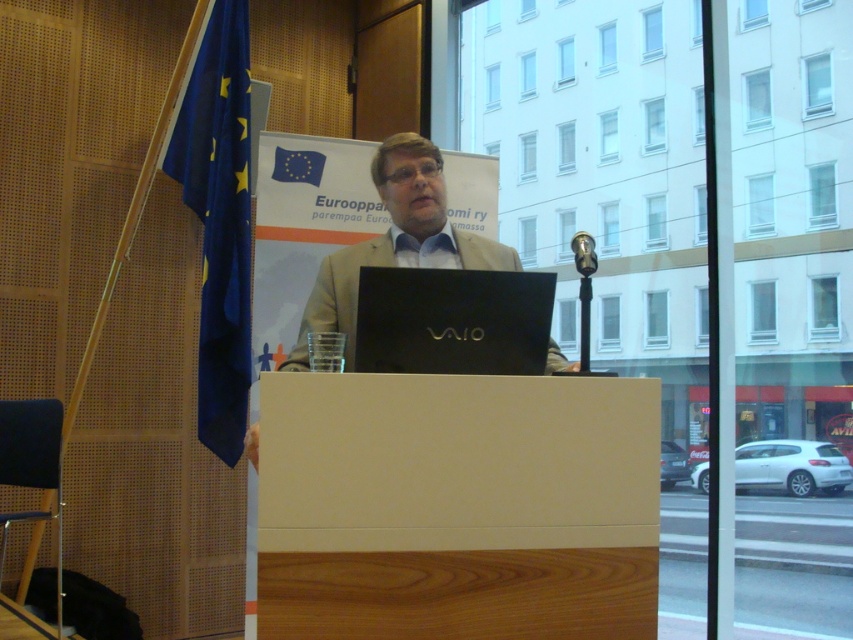
Question: Which point is farther to the camera?

Choices:
 (A) (587, 241)
 (B) (480, 371)

Answer: (A)

Question: Considering the relative positions of matte black laptop at center and metallic at right in the image provided, where is matte black laptop at center located with respect to metallic at right?

Choices:
 (A) above
 (B) below

Answer: (B)

Question: Which is nearer to the matte black laptop at center?

Choices:
 (A) black matte laptop at center
 (B) metallic at right

Answer: (A)

Question: Does matte black laptop at center lie behind metallic at right?

Choices:
 (A) yes
 (B) no

Answer: (A)

Question: Does blue fabric flag at left appear over metallic at right?

Choices:
 (A) no
 (B) yes

Answer: (B)

Question: Which of the following is the farthest from the observer?

Choices:
 (A) (392, 188)
 (B) (352, 369)
 (C) (585, 268)

Answer: (A)